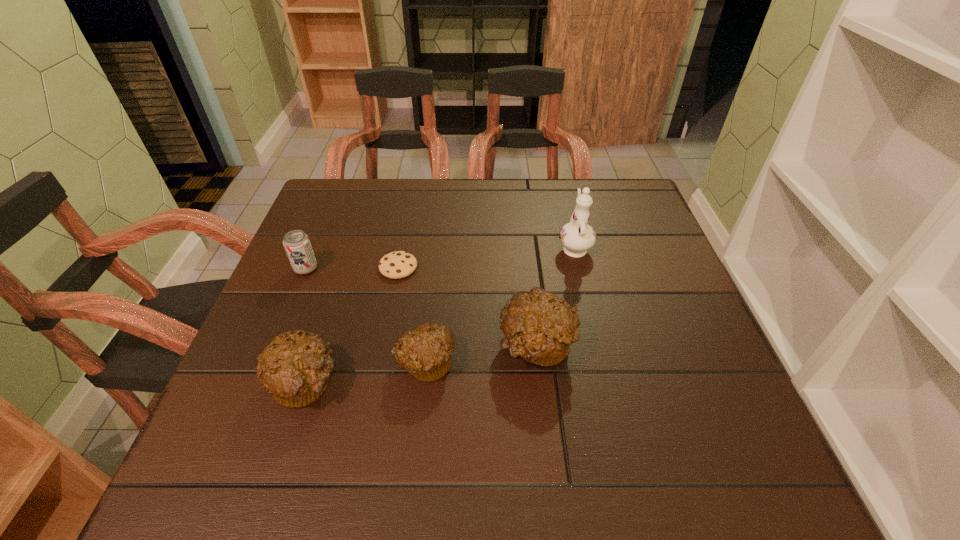
This screenshot has height=540, width=960. I want to click on vacant space that satisfies the following two spatial constraints: 1. on the back side of the shortest object; 2. on the right side of the leftmost muffin, so click(343, 267).